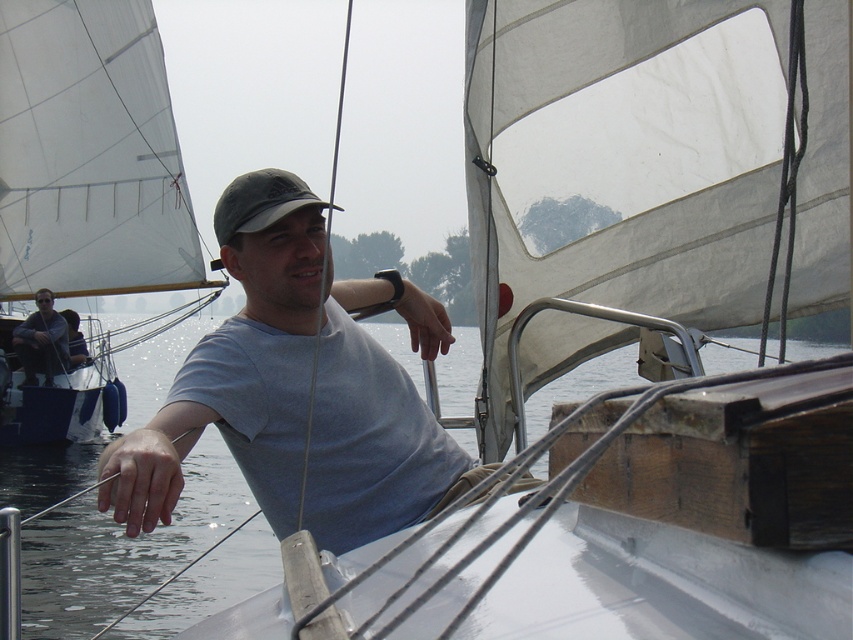
You are a passenger on the sailboat and want to see the water below the matte black shirt at left. Can you see the transparent water at center from your current position?

The transparent water at center is located below the matte black shirt at left, so yes, you can see the transparent water at center from your current position.

You are a sailor on the deck of the boat. You notice the white sail at left and the transparent water at center. Which object is positioned higher relative to the other?

The white sail at left is above transparent water at center, so it is positioned higher.

You are standing at the point marked as point (125, 540) on the sailboat deck. What do you see directly below you?

Transparent water at center is located at point (125, 540), so you would see transparent water at center directly below you.